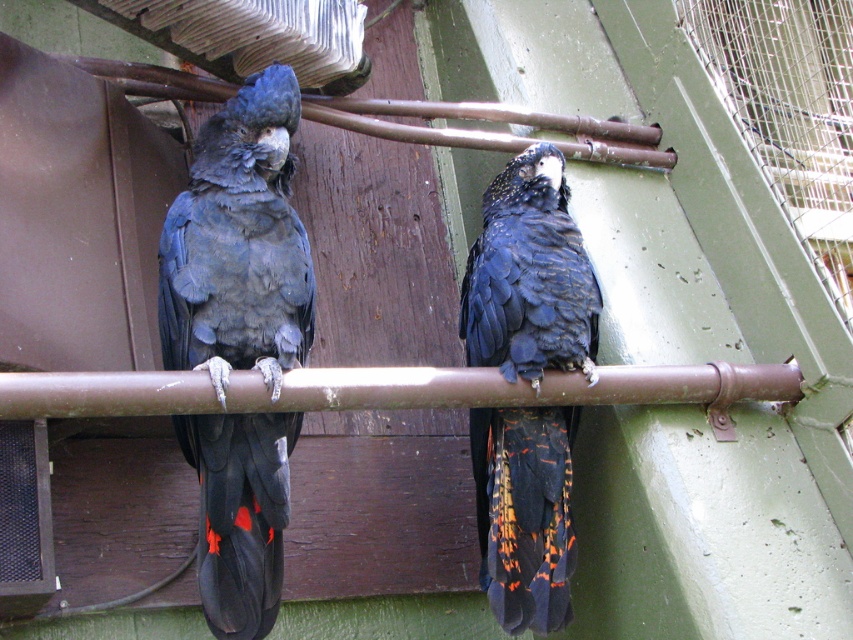
You are observing two points in an aviary scene. The first point is labeled as point (207, 616) and the second is point (538, 592). Based on your perspective, which point is nearer to you?

Point (207, 616) is closer to the camera than point (538, 592).

You are a zookeeper observing two parrots on a metal pipe. You notice the matte black parrot at left and the black glossy feathers at center. Which parrot is taller?

The matte black parrot at left is taller than the black glossy feathers at center.

You are standing at the point labeled point (201,515) and want to take a photo of the two parrots on the metal pipe. If your camera is 2.39 meters away from you, will you be able to capture both parrots in the frame?

Yes, since the distance between you and the camera is 2.39 meters, which matches the camera range, so both parrots should be in the frame.